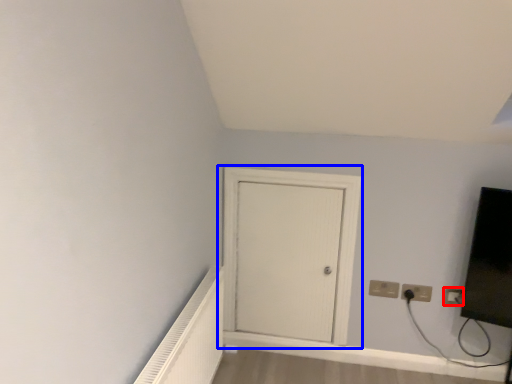
Question: Among these objects, which one is nearest to the camera, electric outlet (highlighted by a red box) or door (highlighted by a blue box)?

Choices:
 (A) electric outlet
 (B) door

Answer: (B)